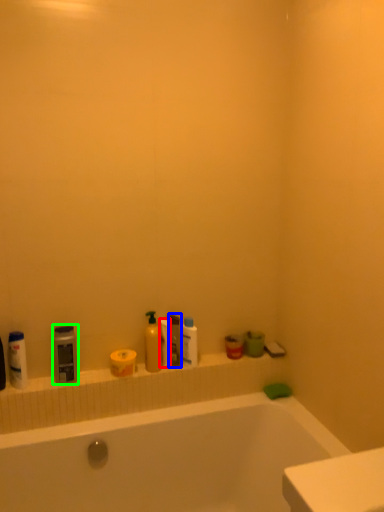
Question: Estimate the real-world distances between objects in this image. Which object is farther from toilet paper (highlighted by a red box), cleaning product (highlighted by a blue box) or cleaning product (highlighted by a green box)?

Choices:
 (A) cleaning product
 (B) cleaning product

Answer: (B)